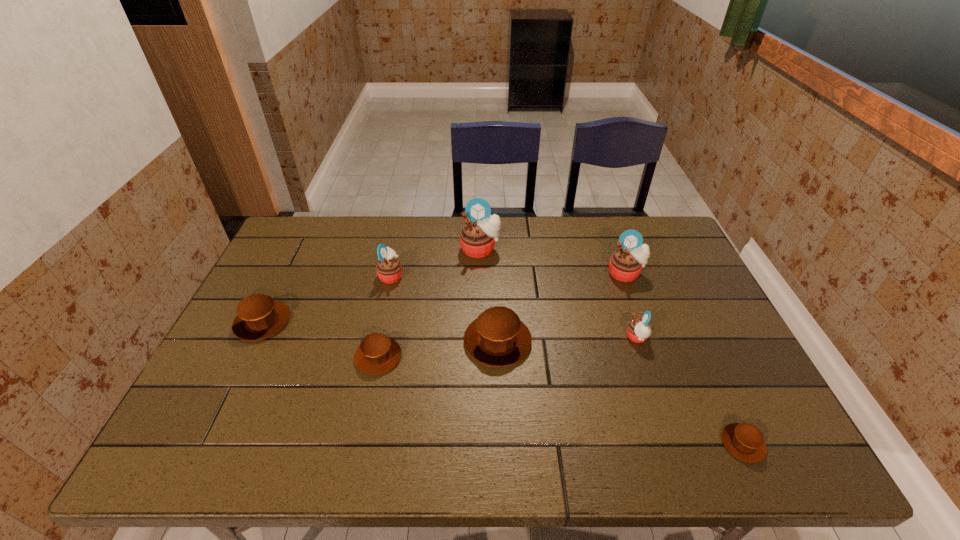
Find the location of a particular element. free space at the right edge is located at coordinates (702, 286).

At what (x,y) coordinates should I click in order to perform the action: click on vacant region at the far left corner of the desktop. Please return your answer as a coordinate pair (x, y). This screenshot has width=960, height=540. Looking at the image, I should click on (315, 221).

Identify the location of vacant position at the far right corner of the desktop. Image resolution: width=960 pixels, height=540 pixels. [x=684, y=249].

Find the location of `empty space that is in between the nearest pink muffin and the leftmost object`. empty space that is in between the nearest pink muffin and the leftmost object is located at coordinates (449, 329).

I want to click on free spot between the nearest object and the farthest object, so click(612, 347).

Locate an element on the screen. free point between the second biggest brown muffin and the third brown muffin from left to right is located at coordinates (380, 332).

The height and width of the screenshot is (540, 960). I want to click on vacant area that lies between the seventh shortest muffin and the biggest pink muffin, so click(x=553, y=261).

The width and height of the screenshot is (960, 540). I want to click on unoccupied position between the smallest pink muffin and the nearest object, so click(x=690, y=390).

Locate an element on the screen. The image size is (960, 540). free space between the smallest pink muffin and the leftmost pink muffin is located at coordinates (514, 306).

At what (x,y) coordinates should I click in order to perform the action: click on unoccupied position between the tallest object and the biggest brown muffin. Please return your answer as a coordinate pair (x, y). The height and width of the screenshot is (540, 960). Looking at the image, I should click on (489, 295).